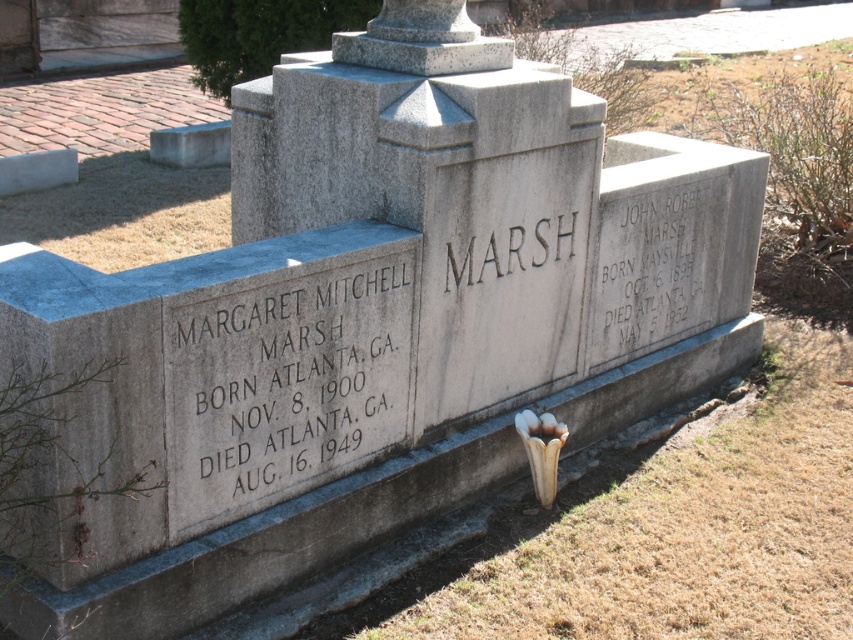
What is the relationship between the size of the white stone plaque at center and the black engraved text at center?

The white stone plaque at center is wider than the black engraved text at center.